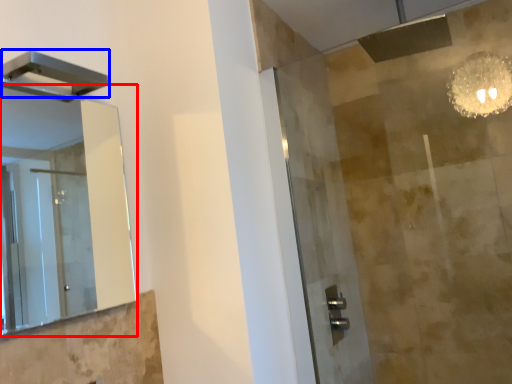
Question: Which object is closer to the camera taking this photo, mirror (highlighted by a red box) or shower (highlighted by a blue box)?

Choices:
 (A) mirror
 (B) shower

Answer: (A)